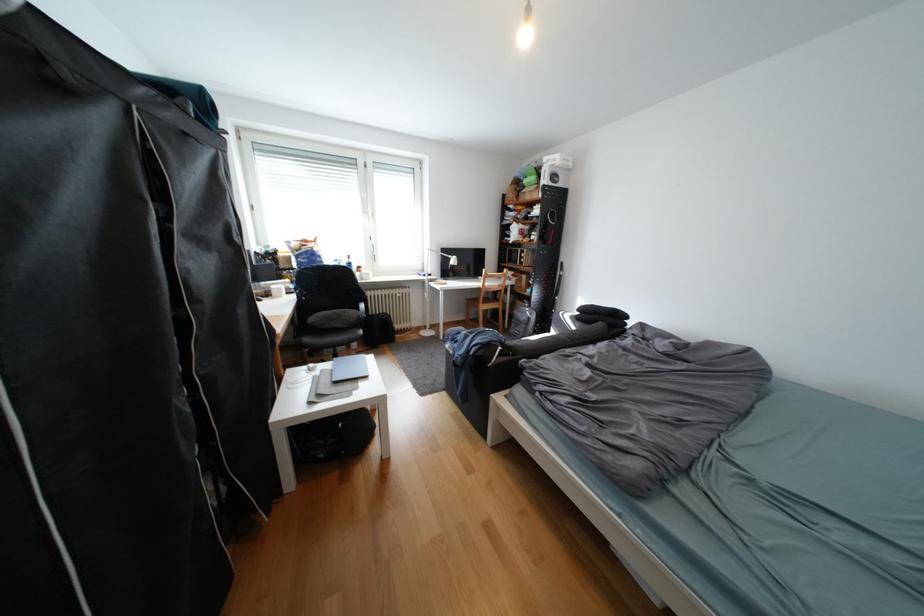
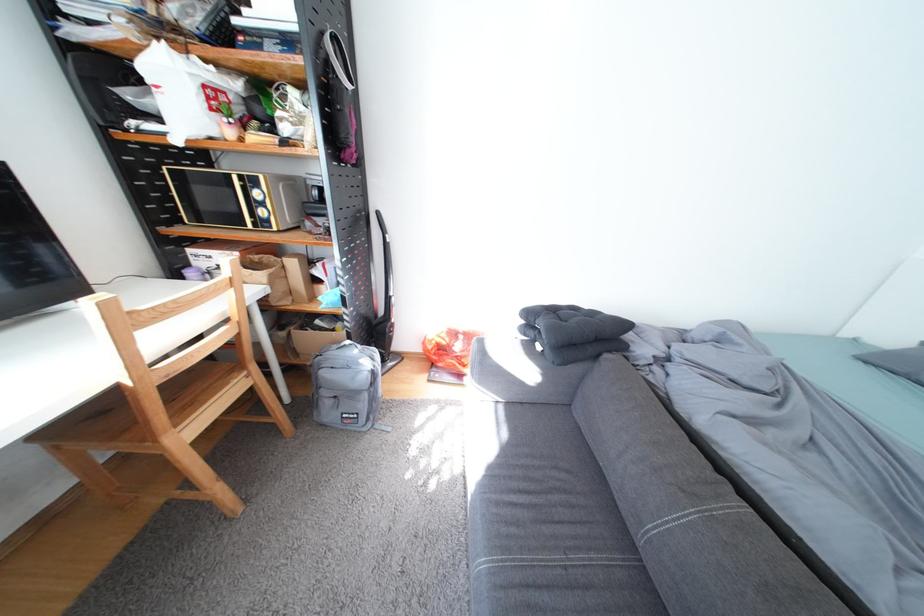
Locate, in the second image, the point that corresponds to (x=536, y=326) in the first image.

(378, 397)